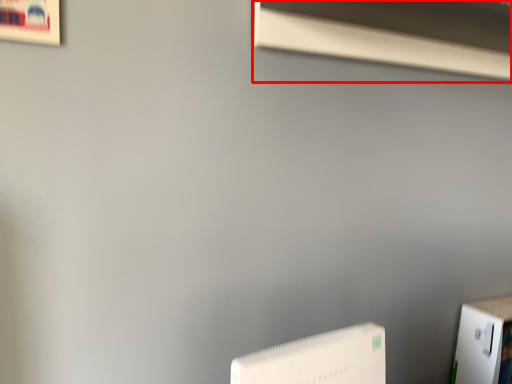
Question: Considering the relative positions of window sill (annotated by the red box) and Wii in the image provided, where is window sill (annotated by the red box) located with respect to the staircase?

Choices:
 (A) left
 (B) right

Answer: (B)